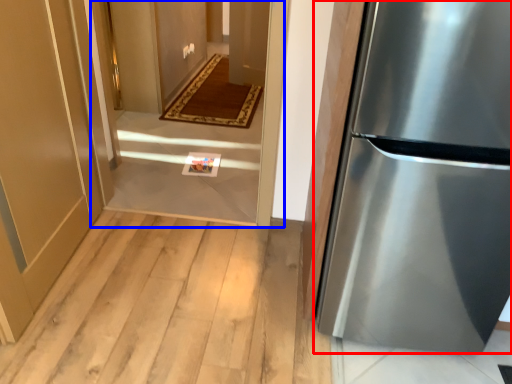
Question: Among these objects, which one is nearest to the camera, refrigerator (highlighted by a red box) or corridor (highlighted by a blue box)?

Choices:
 (A) refrigerator
 (B) corridor

Answer: (A)